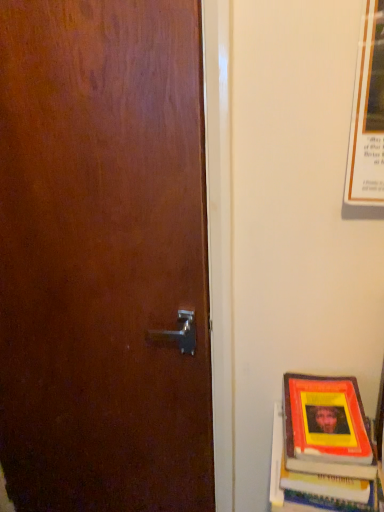
Image resolution: width=384 pixels, height=512 pixels. I want to click on free spot above yellow matte book at lower right (from a real-world perspective), so click(325, 412).